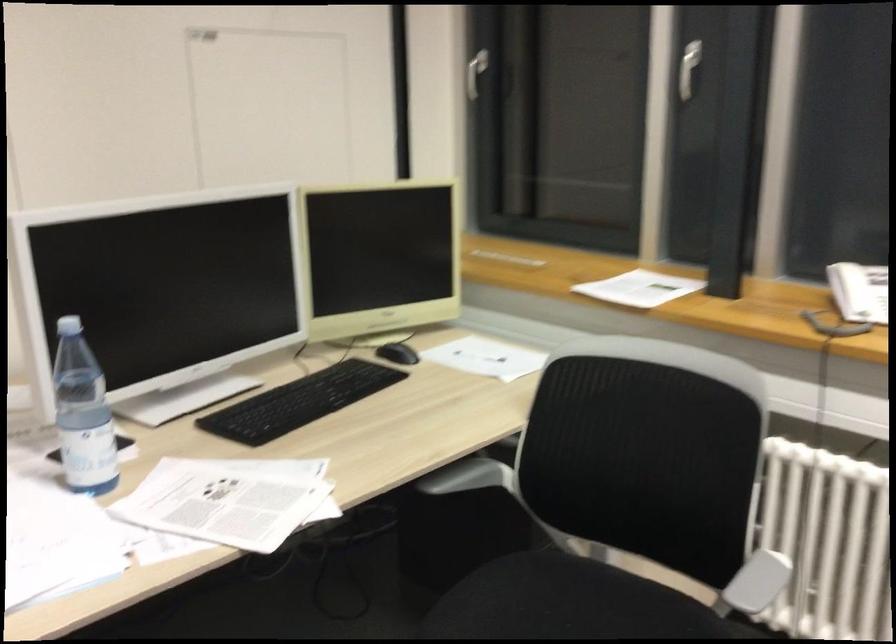
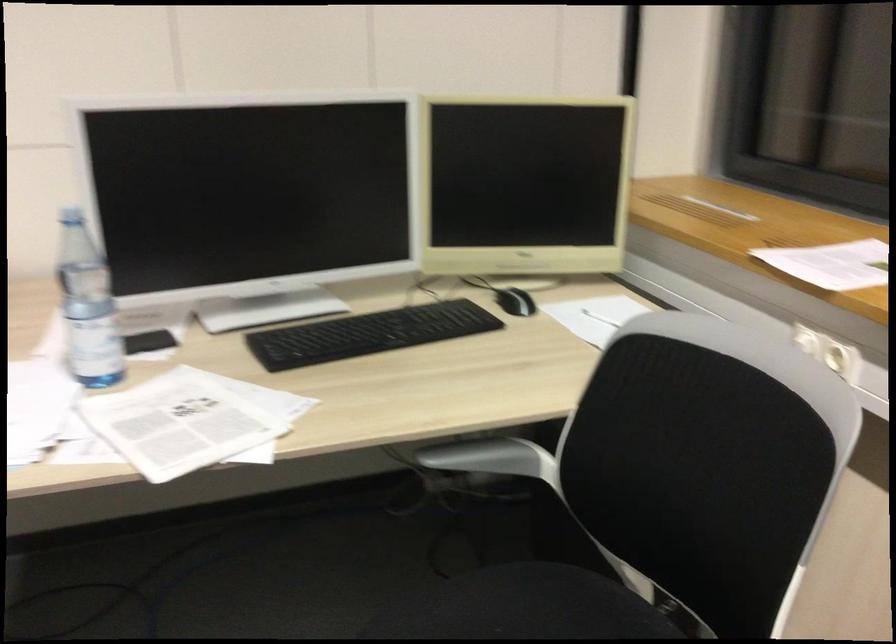
Question: How did the camera likely rotate?

Choices:
 (A) Left
 (B) Right
 (C) Up
 (D) Down

Answer: (A)